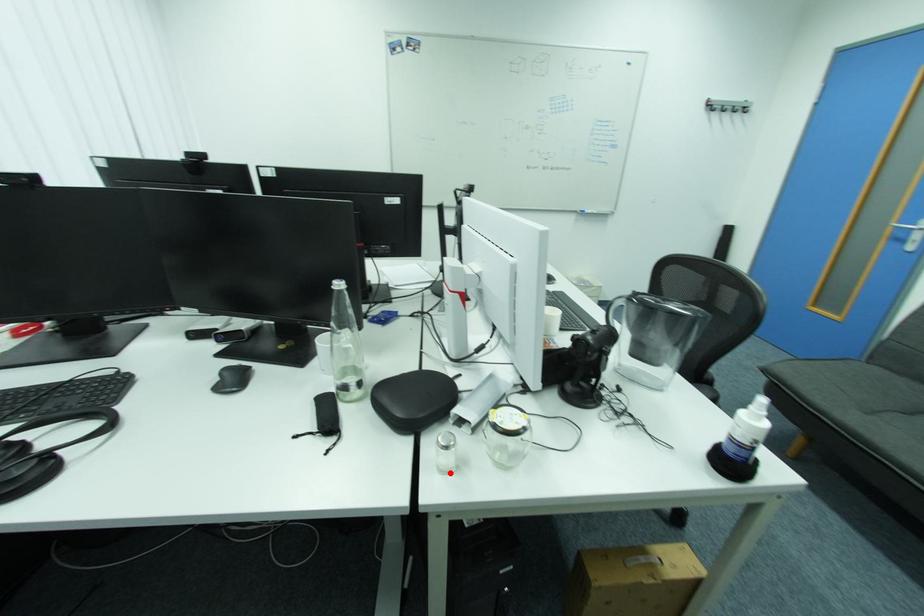
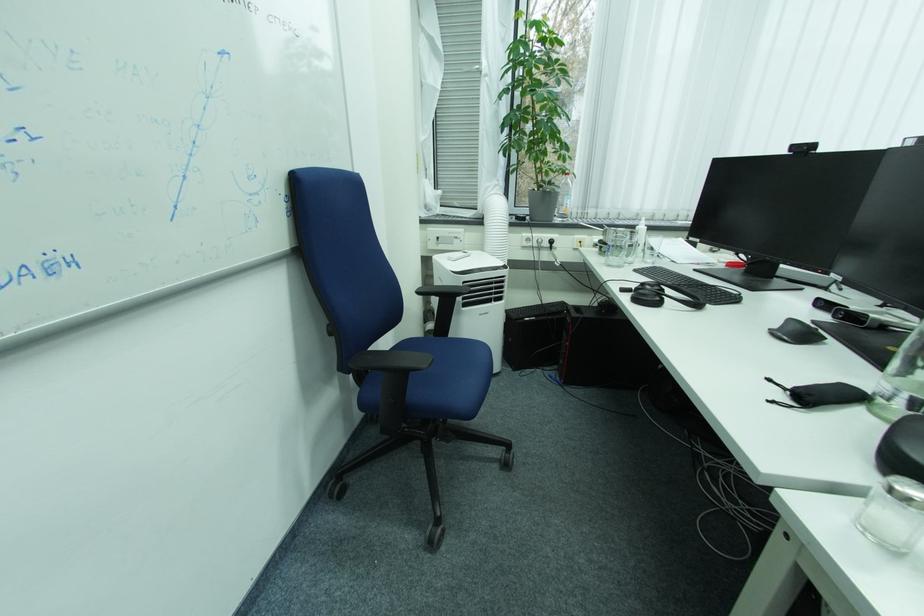
In the second image, find the point that corresponds to the highlighted location in the first image.

(870, 529)